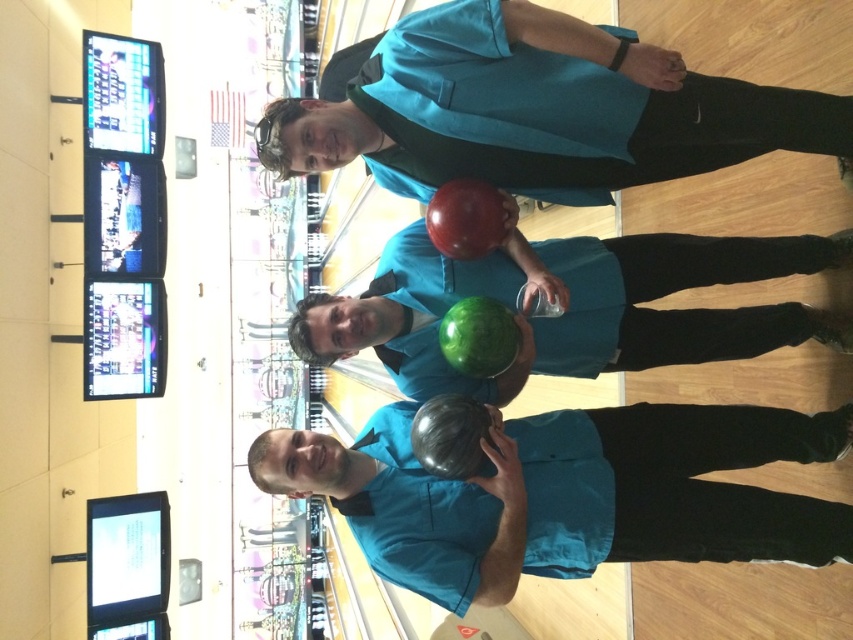
Question: Can you confirm if matte black bowling ball at center is positioned to the right of matte teal bowling ball at upper center?

Choices:
 (A) yes
 (B) no

Answer: (A)

Question: Observing the image, what is the correct spatial positioning of matte black bowling ball at center in reference to matte teal bowling ball at upper center?

Choices:
 (A) right
 (B) left

Answer: (A)

Question: Which point is farther to the camera?

Choices:
 (A) (426, 577)
 (B) (540, 243)
 (C) (434, 168)

Answer: (B)

Question: Which of these objects is positioned farthest from the shiny green bowling ball at center?

Choices:
 (A) matte black bowling ball at center
 (B) matte teal bowling ball at upper center

Answer: (B)

Question: In this image, where is matte teal bowling ball at upper center located relative to shiny green bowling ball at center?

Choices:
 (A) above
 (B) below

Answer: (A)

Question: Among these points, which one is farthest from the camera?

Choices:
 (A) (583, 340)
 (B) (532, 97)

Answer: (A)